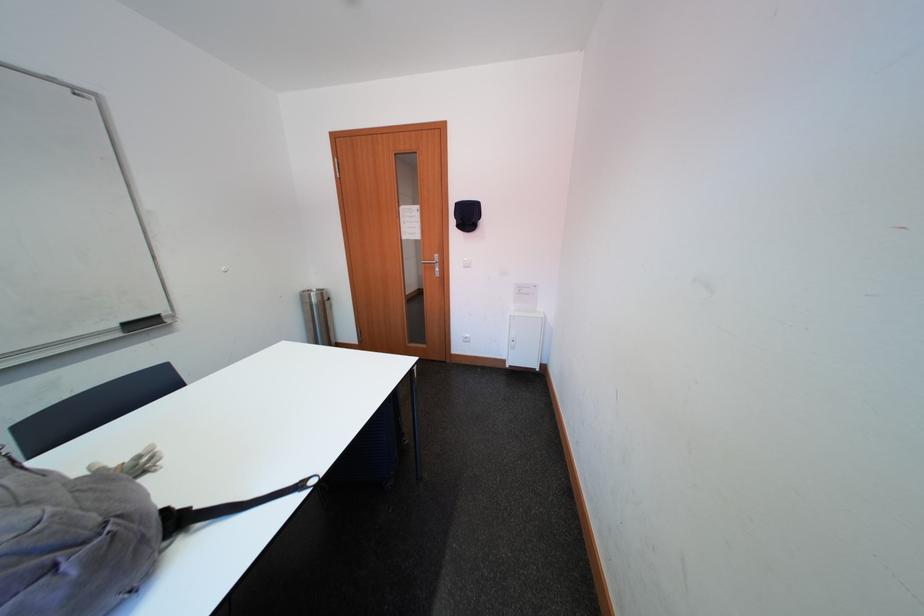
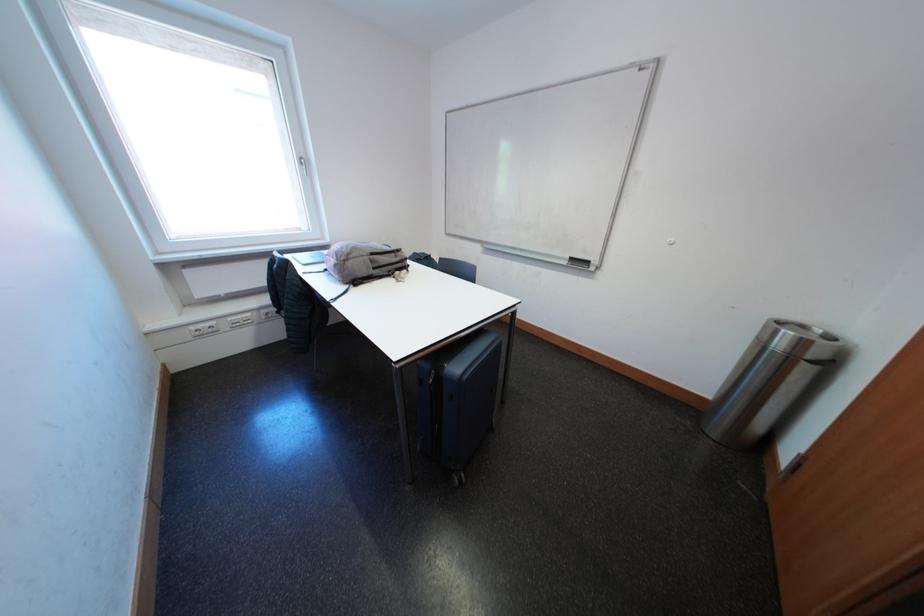
Find the pixel in the second image that matches pixel 334 302 in the first image.

(821, 360)